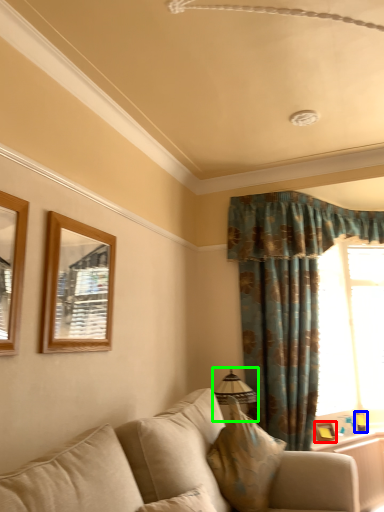
Question: Considering the real-world distances, which object is closest to picture frame (highlighted by a red box)? picture frame (highlighted by a blue box) or lamp (highlighted by a green box).

Choices:
 (A) picture frame
 (B) lamp

Answer: (A)